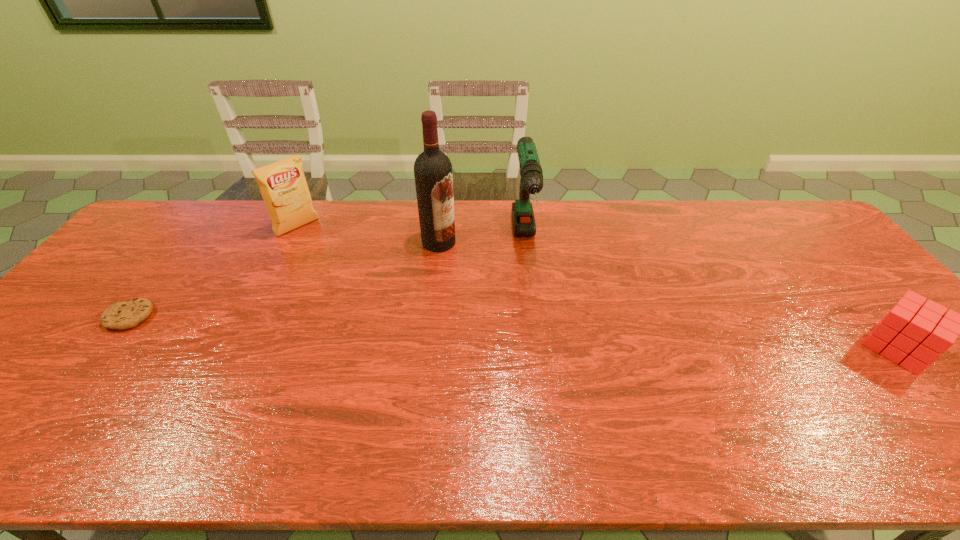
Find the location of a particular element. This screenshot has height=540, width=960. free spot on the desktop that is between the leftmost object and the rightmost object and is positioned on the handle side of the fourth shortest object is located at coordinates (539, 333).

Image resolution: width=960 pixels, height=540 pixels. In order to click on vacant spot on the desktop that is between the leftmost object and the second shortest object and is positioned on the label of the wine bottle in this screenshot , I will do `click(544, 333)`.

This screenshot has width=960, height=540. In order to click on free space on the desktop that is between the cookie and the cube and is positioned on the front of the third shortest object with the logo in this screenshot , I will do `click(404, 328)`.